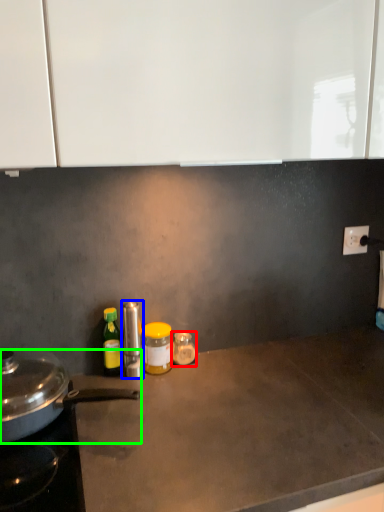
Question: Considering the real-world distances, which object is farthest from bottle (highlighted by a red box)? kitchen appliance (highlighted by a blue box) or kitchen appliance (highlighted by a green box)?

Choices:
 (A) kitchen appliance
 (B) kitchen appliance

Answer: (B)